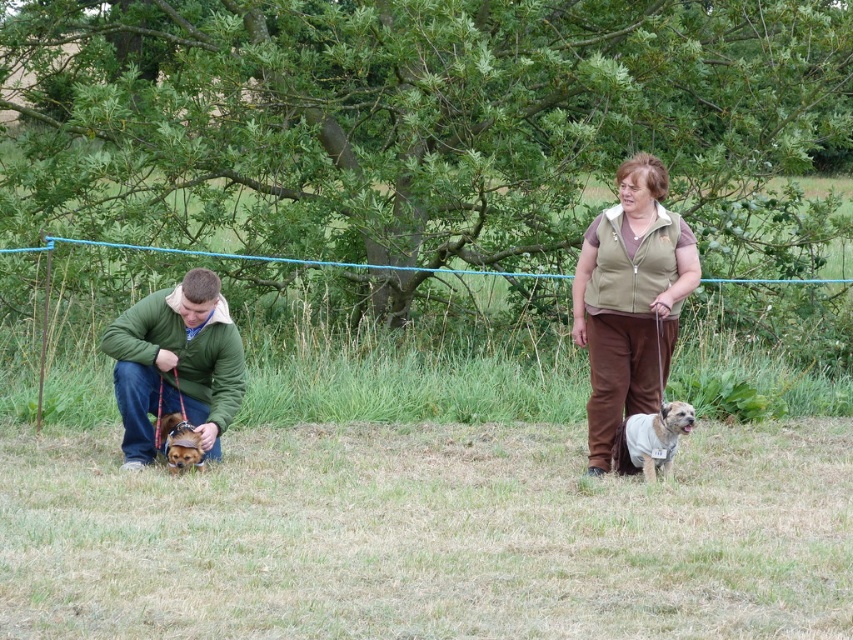
You are a photographer trying to capture a photo of the green grass at lower center and the brown fleece vest at center. Which object should you focus on first if you want to include both in your shot without moving the camera?

The green grass at lower center is located below the brown fleece vest at center, so you should focus on the brown fleece vest at center first to ensure both are in frame.

You are a photographer standing in the park and want to take a photo of the brown fleece vest at center and the brown furry dog at lower left. Which object will appear larger in the photo?

The brown fleece vest at center will appear larger in the photo because it is closer to the viewer than the brown furry dog at lower left.

You are a photographer standing in the park and want to take a photo of both the brown fleece vest at center and the light brown fur at center. Which object should you focus on first to ensure both are in sharp focus?

You should focus on the brown fleece vest at center first because it is closer to you than the light brown fur at center, ensuring both will be in focus when using depth of field appropriately.